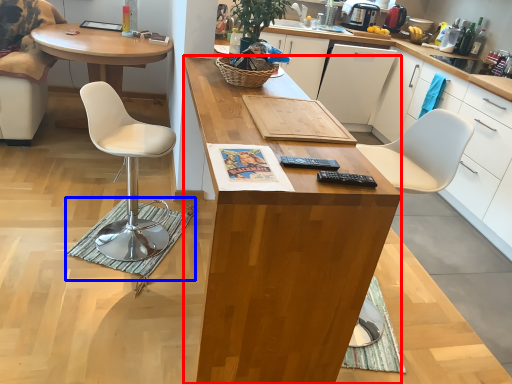
Question: Among these objects, which one is farthest to the camera, desk (highlighted by a red box) or mat (highlighted by a blue box)?

Choices:
 (A) desk
 (B) mat

Answer: (B)